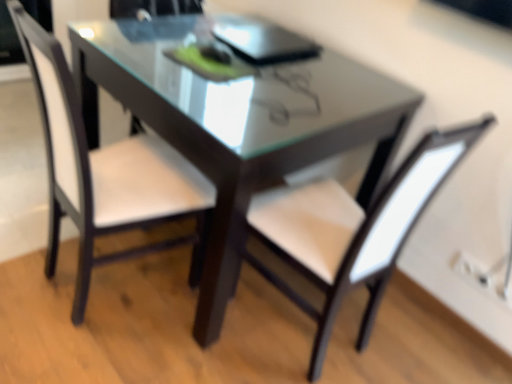
Question: From a real-world perspective, is white leather chair at center, the second chair from the right, over transparent glass table at center?

Choices:
 (A) yes
 (B) no

Answer: (A)

Question: Considering the relative sizes of white leather chair at center, the second chair from the right, and transparent glass table at center in the image provided, is white leather chair at center, the second chair from the right, smaller than transparent glass table at center?

Choices:
 (A) no
 (B) yes

Answer: (B)

Question: Considering the relative sizes of white leather chair at center, the second chair from the right, and transparent glass table at center in the image provided, is white leather chair at center, the second chair from the right, thinner than transparent glass table at center?

Choices:
 (A) yes
 (B) no

Answer: (A)

Question: Is white leather chair at center, the second chair from the right, surrounding transparent glass table at center?

Choices:
 (A) yes
 (B) no

Answer: (B)

Question: Does white leather chair at center, marked as the 1th chair in a left-to-right arrangement, have a larger size compared to transparent glass table at center?

Choices:
 (A) no
 (B) yes

Answer: (A)

Question: Is white leather chair at center, marked as the 1th chair in a left-to-right arrangement, oriented towards transparent glass table at center?

Choices:
 (A) no
 (B) yes

Answer: (B)

Question: Is white leather chair at center, marked as the first chair in a right-to-left arrangement, not inside transparent glass table at center?

Choices:
 (A) yes
 (B) no

Answer: (A)

Question: Is white leather chair at center, marked as the 2th chair in a left-to-right arrangement, at the right side of transparent glass table at center?

Choices:
 (A) no
 (B) yes

Answer: (B)

Question: Can you confirm if white leather chair at center, marked as the first chair in a right-to-left arrangement, is taller than transparent glass table at center?

Choices:
 (A) no
 (B) yes

Answer: (B)

Question: Can you confirm if white leather chair at center, marked as the first chair in a right-to-left arrangement, is thinner than transparent glass table at center?

Choices:
 (A) yes
 (B) no

Answer: (A)

Question: Does white leather chair at center, marked as the first chair in a right-to-left arrangement, appear on the left side of transparent glass table at center?

Choices:
 (A) yes
 (B) no

Answer: (B)

Question: Is white leather chair at center, marked as the 2th chair in a left-to-right arrangement, bigger than transparent glass table at center?

Choices:
 (A) no
 (B) yes

Answer: (A)

Question: Does white leather chair at center, marked as the first chair in a right-to-left arrangement, turn towards white leather chair at center, the second chair from the right?

Choices:
 (A) yes
 (B) no

Answer: (B)